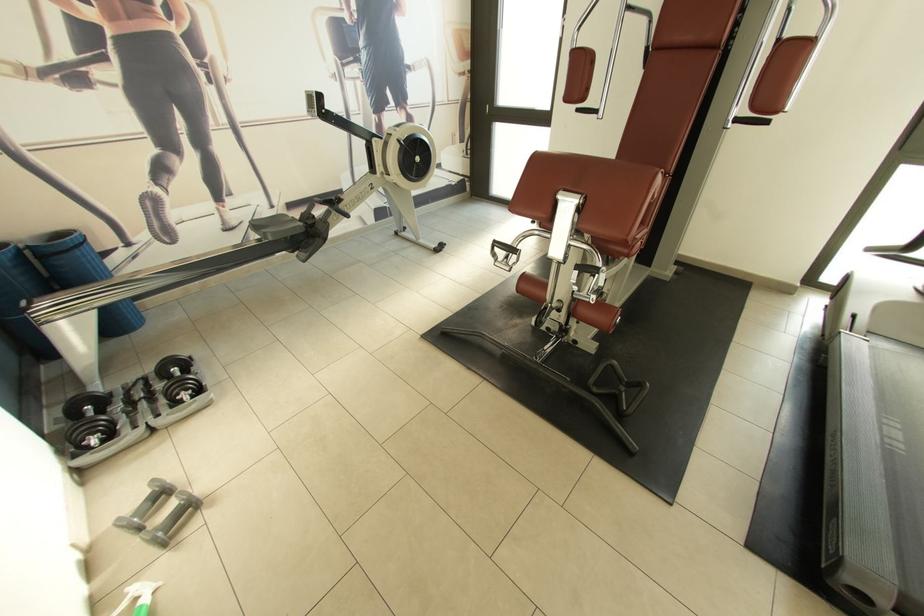
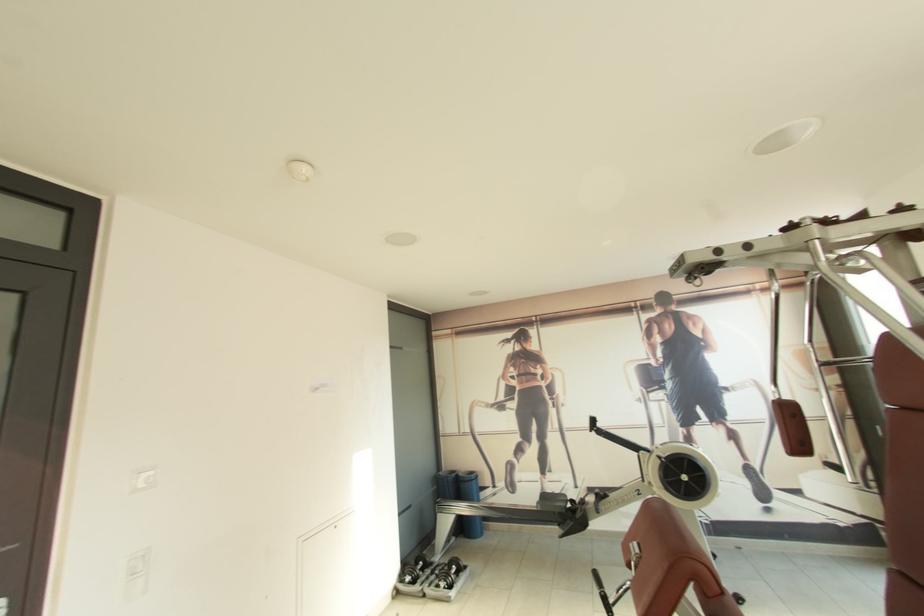
Find the pixel in the second image that matches (x=107, y=424) in the first image.

(419, 575)